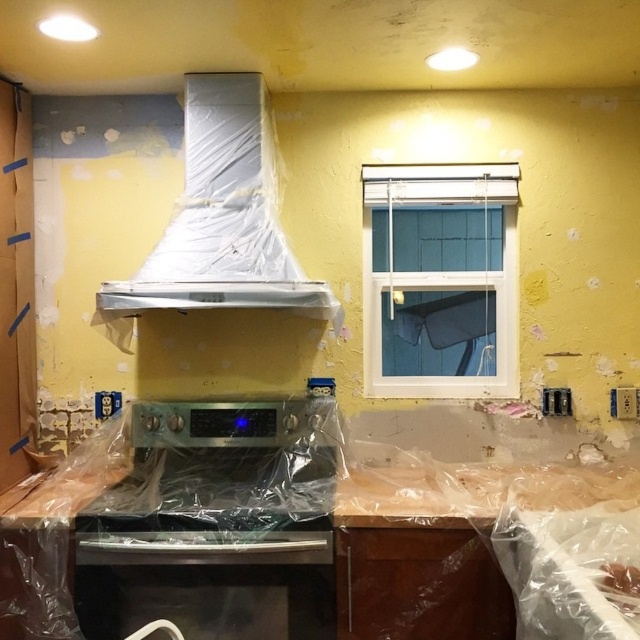
You are a contractor working in the kitchen and need to install a new appliance between the satin silver oven at center and the white plastic exhaust hood at upper center. Based on their positions, which appliance should be placed to the left or right of the other?

The satin silver oven at center is positioned on the left side of white plastic exhaust hood at upper center, so the new appliance should be placed to the right of the oven or to the left of the hood to maintain their existing arrangement.

You are a contractor holding a 2.0 meter long ladder. You need to place the ladder in the kitchen near the satin silver oven at center. Is the distance between you and the oven sufficient to safely place the ladder without it hitting the oven?

The satin silver oven at center is 2.17 meters from the camera. Since the ladder is 2.0 meters long, the distance is sufficient to safely place the ladder near the oven without it hitting the oven.

You are a contractor inspecting the kitchen renovation. You notice the satin silver oven at center and the white plastic exhaust hood at upper center. According to the building code, the oven must be positioned directly under the exhaust hood. Does the current placement comply with this requirement?

The satin silver oven at center is located below the white plastic exhaust hood at upper center, so the current placement complies with the building code requirement.